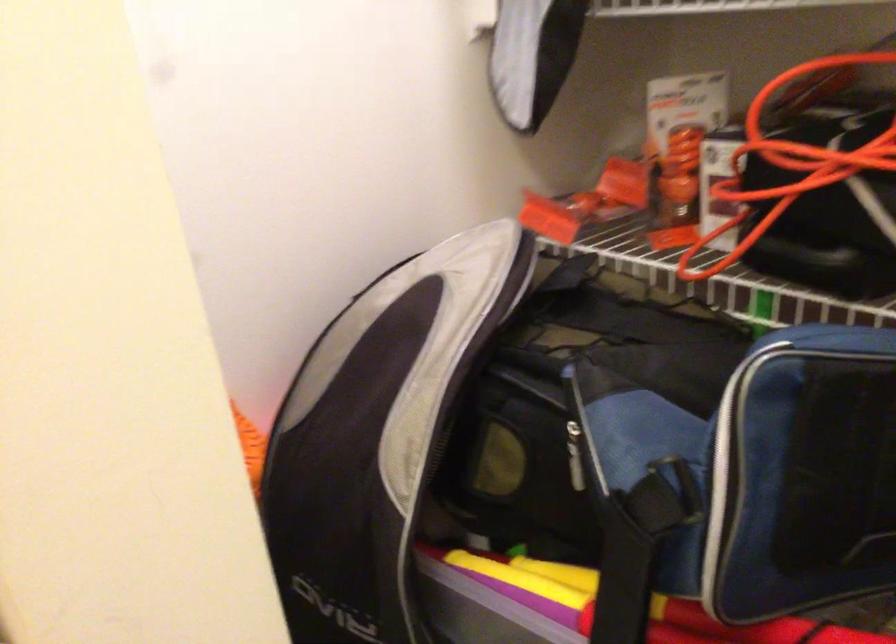
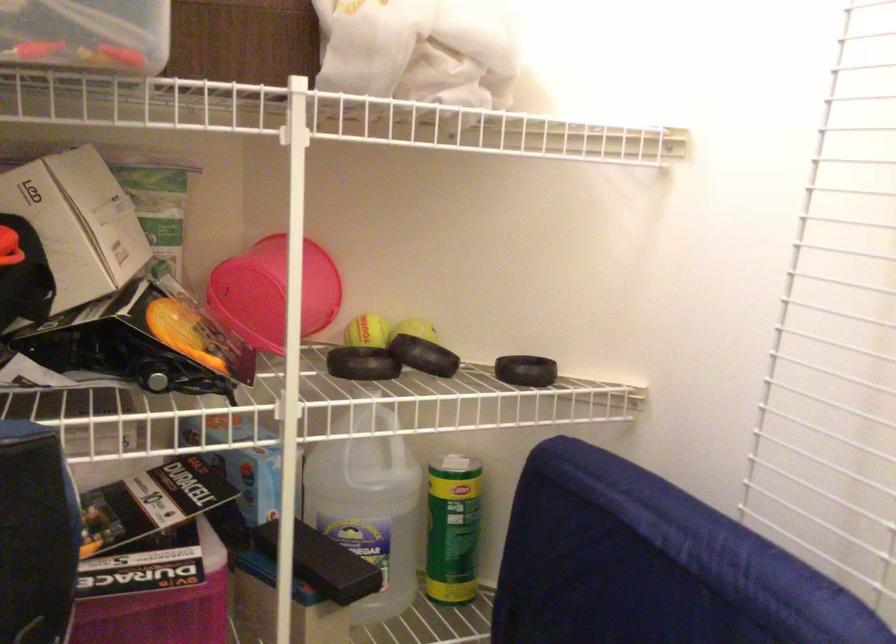
Question: Based on the continuous images, in which direction is the camera rotating? Reply with the corresponding letter.

Choices:
 (A) Left
 (B) Right
 (C) Up
 (D) Down

Answer: (B)